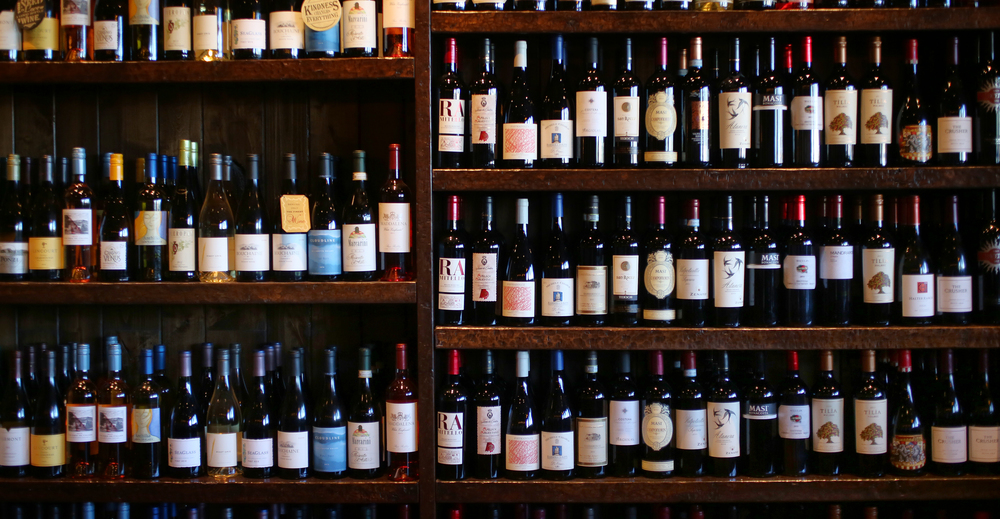
This screenshot has height=519, width=1000. In order to click on number of visible wooden shelves in this screenshot , I will do `click(278, 71)`, `click(288, 487)`, `click(485, 331)`, `click(488, 171)`, `click(493, 19)`.